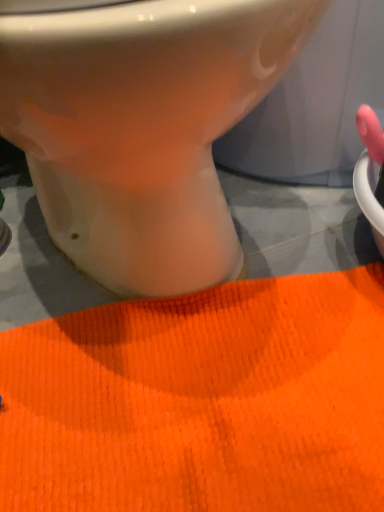
Find the location of a particular element. matte white toilet at center is located at coordinates (142, 128).

This screenshot has width=384, height=512. What do you see at coordinates (142, 128) in the screenshot? I see `matte white toilet at center` at bounding box center [142, 128].

Find the location of a particular element. The width and height of the screenshot is (384, 512). matte white toilet at center is located at coordinates (142, 128).